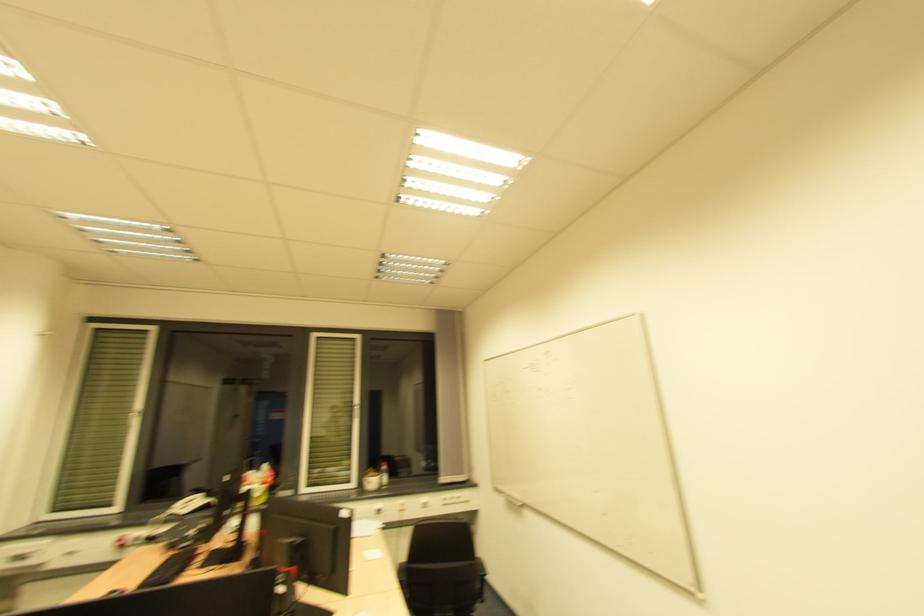
Where would you lift the telephone receiver? Please return your answer as a coordinate pair (x, y).

(186, 506)